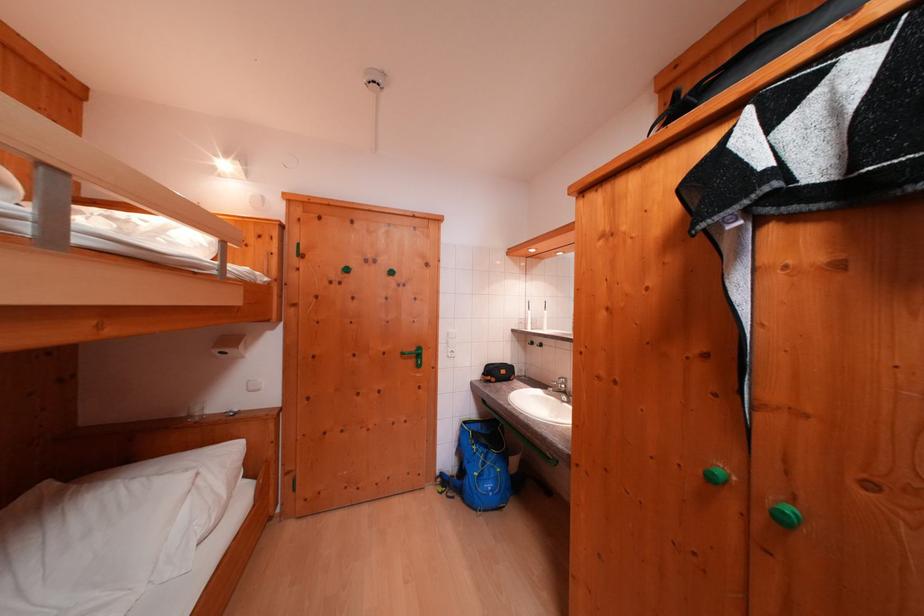
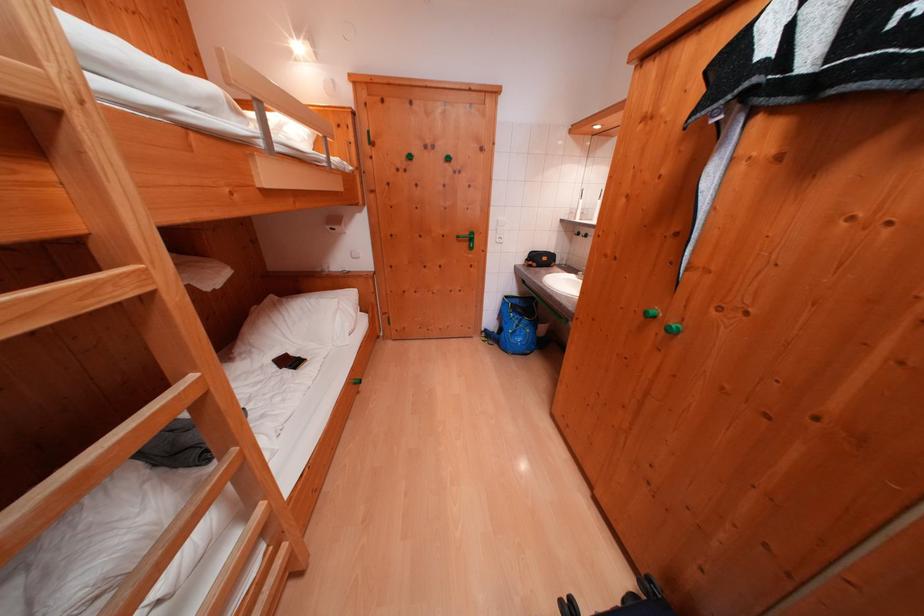
In the second image, find the point that corresponds to the point at 410,358 in the first image.

(466, 241)